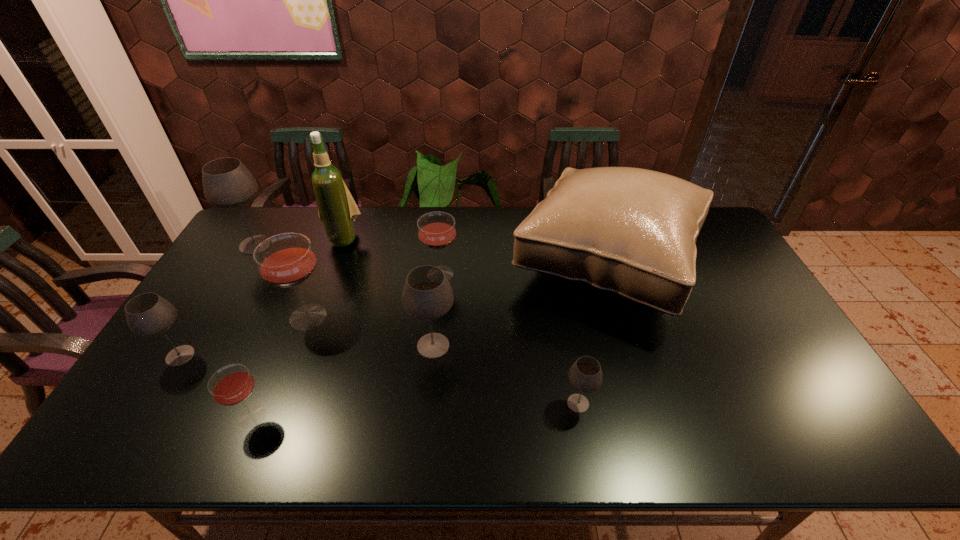
Locate an element on the screen. The image size is (960, 540). vacant position located 0.070m on the front of the nearest gray wineglass is located at coordinates 586,446.

The width and height of the screenshot is (960, 540). What are the coordinates of `wine bottle that is at the far edge` in the screenshot? It's located at (337, 210).

In order to click on cushion that is at the far edge in this screenshot , I will do `click(629, 232)`.

Image resolution: width=960 pixels, height=540 pixels. I want to click on wineglass that is at the far edge, so click(227, 183).

Image resolution: width=960 pixels, height=540 pixels. Find the location of `object at the near edge`. object at the near edge is located at coordinates (231, 385).

Where is `object that is at the right edge`? This screenshot has height=540, width=960. object that is at the right edge is located at coordinates (x=629, y=232).

Where is `object positioned at the far left corner`? The width and height of the screenshot is (960, 540). object positioned at the far left corner is located at coordinates (227, 183).

Where is `object that is at the far right corner`? object that is at the far right corner is located at coordinates (629, 232).

Find the location of a particular element. The height and width of the screenshot is (540, 960). vacant space at the far edge of the desktop is located at coordinates (494, 236).

The image size is (960, 540). Identify the location of free space at the near edge of the desktop. (589, 447).